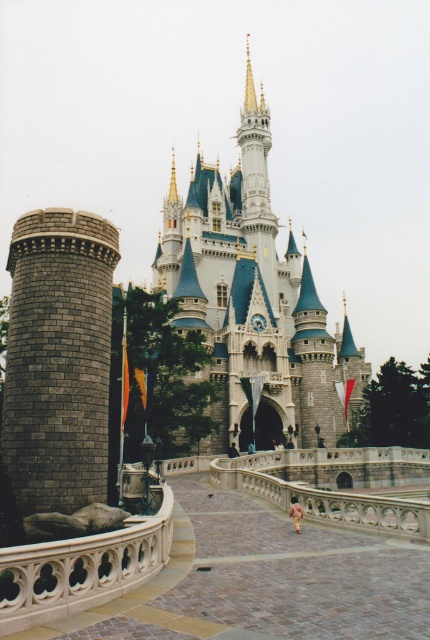
Question: Which object appears farthest from the camera in this image?

Choices:
 (A) white stone castle at center
 (B) gray brick tower at left

Answer: (A)

Question: Which object appears closest to the camera in this image?

Choices:
 (A) white stone castle at center
 (B) gray brick tower at left

Answer: (B)

Question: Does white stone castle at center appear on the right side of gray brick tower at left?

Choices:
 (A) no
 (B) yes

Answer: (B)

Question: Which point is farther to the camera?

Choices:
 (A) (251, 172)
 (B) (18, 380)

Answer: (A)

Question: Is white stone castle at center above gray brick tower at left?

Choices:
 (A) yes
 (B) no

Answer: (A)

Question: In this image, where is white stone castle at center located relative to gray brick tower at left?

Choices:
 (A) left
 (B) right

Answer: (B)